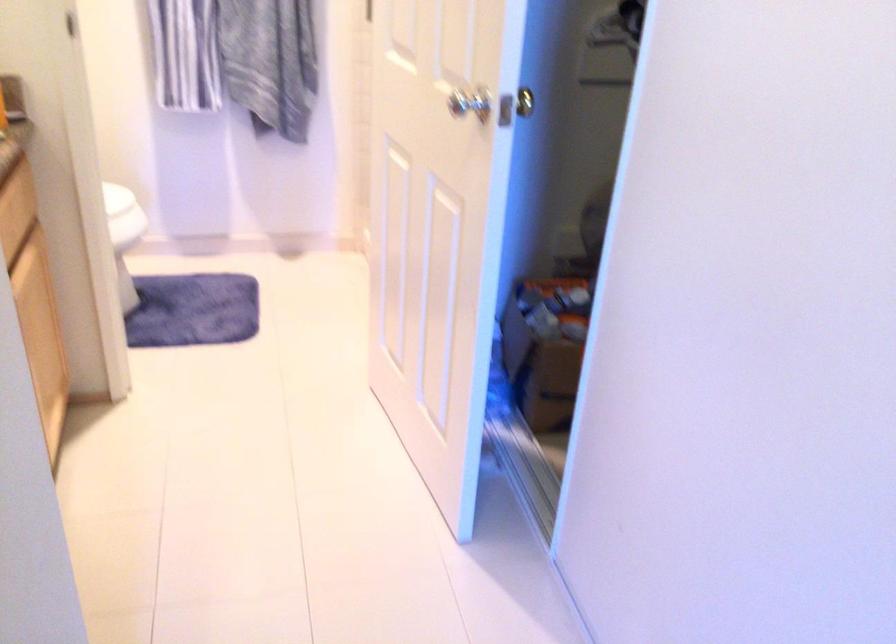
Where is `silver door handle`? silver door handle is located at coordinates [467, 102].